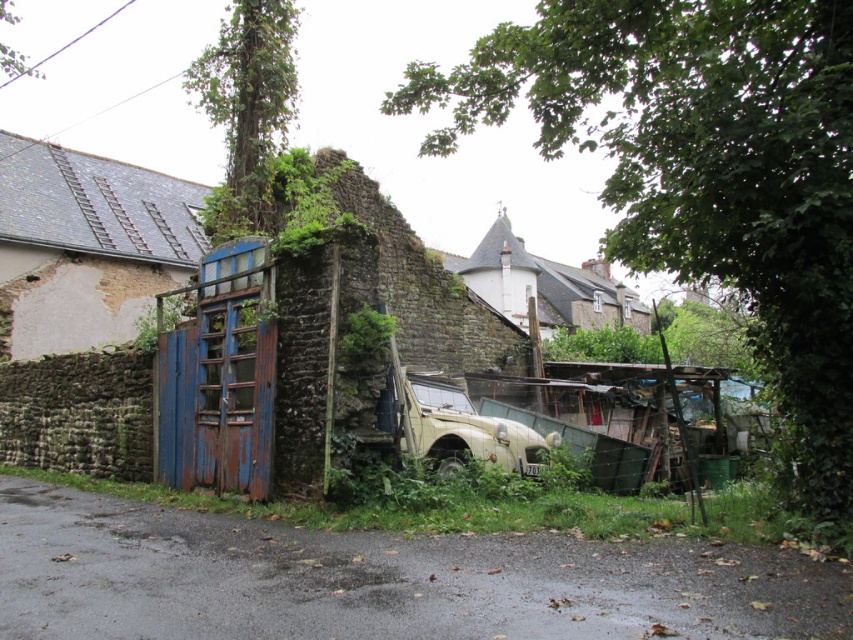
Who is positioned more to the right, green leafy ivy at lower center or green leafy weed at center?

From the viewer's perspective, green leafy ivy at lower center appears more on the right side.

Is point (836, 509) behind point (358, 348)?

That is False.

This screenshot has width=853, height=640. I want to click on green leafy ivy at lower center, so (704, 170).

Which of these two, green leafy ivy at lower center or green matte car at center, stands shorter?

Standing shorter between the two is green matte car at center.

Is point (837, 376) farther from camera compared to point (525, 452)?

No, (837, 376) is closer to viewer.

Image resolution: width=853 pixels, height=640 pixels. Identify the location of green leafy ivy at lower center. (704, 170).

Between green matte car at center and green leafy weed at center, which one appears on the right side from the viewer's perspective?

From the viewer's perspective, green matte car at center appears more on the right side.

Can you confirm if green matte car at center is positioned to the left of green leafy weed at center?

In fact, green matte car at center is to the right of green leafy weed at center.

Who is more distant from viewer, (x=483, y=444) or (x=355, y=353)?

The point (x=483, y=444) is behind.

Where is `green matte car at center`? Image resolution: width=853 pixels, height=640 pixels. green matte car at center is located at coordinates (465, 429).